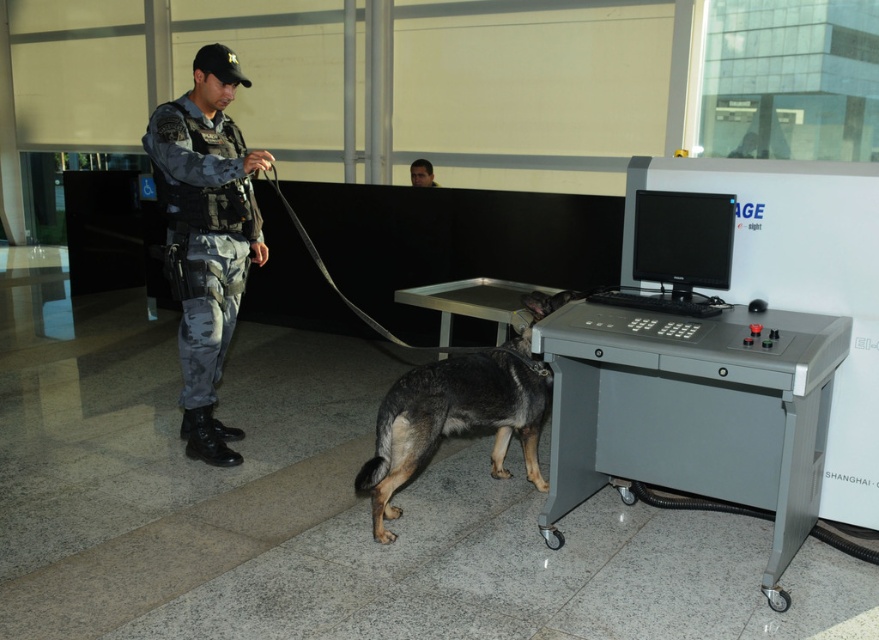
You are an airport security officer who needs to move the gray metallic control panel at lower right and the dark gray fur dog at center to a different checkpoint area. The new area has a narrow passage that is only 1 meter wide. Based on the sizes of the objects, can both items fit through the passage side by side?

The gray metallic control panel at lower right is wider than the dark gray fur dog at center. However, since the passage is only 1 meter wide, you need to check if their combined widths are less than or equal to 1 meter. Unfortunately, without knowing the exact widths, it is impossible to determine if they can fit side by side.

You are a technician who needs to access the gray metallic control panel at lower right. There is a dark gray fur dog at center nearby. Considering their sizes, can you easily reach the control panel without moving the dog?

The gray metallic control panel at lower right is bigger than the dark gray fur dog at center, so it should be easier to reach around the dog since the control panel takes up more space. However, you should still ensure the dog is not blocking access before proceeding.

You are a security officer at the checkpoint. You need to quickly move the dark gray fur dog at center away from the gray metallic control panel at lower right. Which direction should you guide the dog to move to get it away from the control panel?

Since the gray metallic control panel at lower right is to the right of the dark gray fur dog at center, you should guide the dog to move to the left to get it away from the control panel.